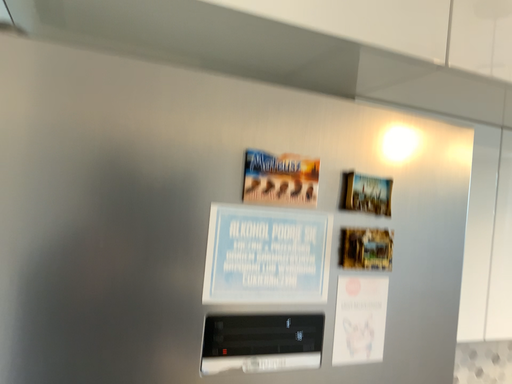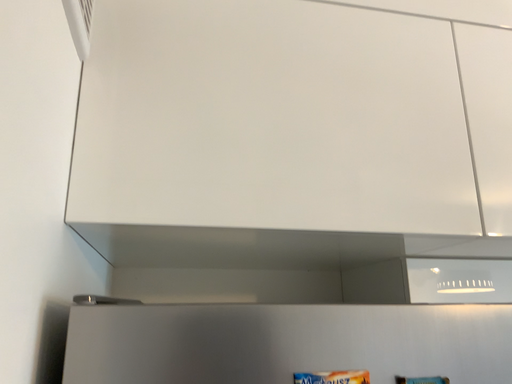
Question: How did the camera likely rotate when shooting the video?

Choices:
 (A) rotated downward
 (B) rotated upward

Answer: (B)